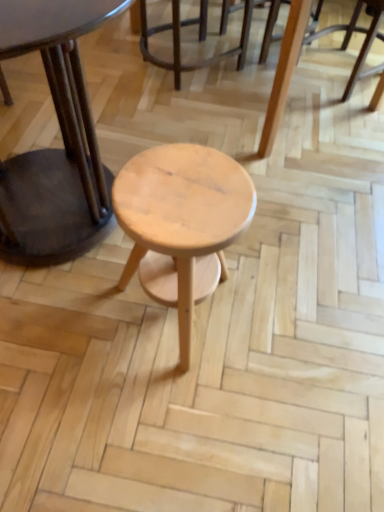
The height and width of the screenshot is (512, 384). I want to click on blank space situated above natural wood stool at center (from a real-world perspective), so click(184, 188).